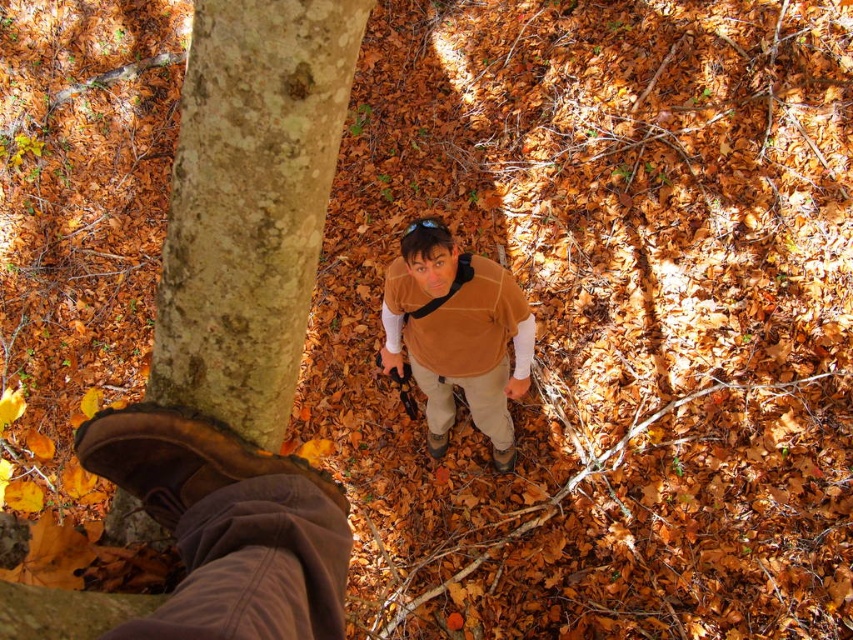
Question: Can you confirm if smooth bark tree trunk at center is wider than brown suede vest at center?

Choices:
 (A) no
 (B) yes

Answer: (A)

Question: Among these objects, which one is nearest to the camera?

Choices:
 (A) smooth bark tree trunk at center
 (B) brown suede vest at center

Answer: (A)

Question: Which object is closer to the camera taking this photo?

Choices:
 (A) brown suede vest at center
 (B) smooth bark tree trunk at center

Answer: (B)

Question: Which point is closer to the camera taking this photo?

Choices:
 (A) (289, 209)
 (B) (445, 314)

Answer: (A)

Question: Does smooth bark tree trunk at center have a larger size compared to brown suede vest at center?

Choices:
 (A) no
 (B) yes

Answer: (A)

Question: Is smooth bark tree trunk at center wider than brown suede vest at center?

Choices:
 (A) yes
 (B) no

Answer: (B)